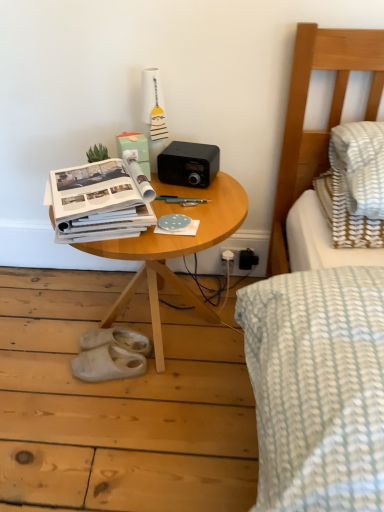
Question: Does white paper at center lie behind white rubber slippers at lower left, the 1th footwear in the front-to-back sequence?

Choices:
 (A) yes
 (B) no

Answer: (B)

Question: Is white paper at center bigger than white rubber slippers at lower left, the 1th footwear in the front-to-back sequence?

Choices:
 (A) yes
 (B) no

Answer: (A)

Question: Does white paper at center have a greater height compared to white rubber slippers at lower left, the second footwear when ordered from back to front?

Choices:
 (A) yes
 (B) no

Answer: (A)

Question: Is white paper at center aimed at white rubber slippers at lower left, the 1th footwear in the front-to-back sequence?

Choices:
 (A) no
 (B) yes

Answer: (A)

Question: Is white paper at center looking in the opposite direction of white rubber slippers at lower left, the second footwear when ordered from back to front?

Choices:
 (A) yes
 (B) no

Answer: (B)

Question: Would you say white paper at center contains white rubber slippers at lower left, the 1th footwear in the front-to-back sequence?

Choices:
 (A) no
 (B) yes

Answer: (A)

Question: Is wooden table at center closer to the viewer compared to white rubber slippers at lower left, the second footwear when ordered from back to front?

Choices:
 (A) yes
 (B) no

Answer: (A)

Question: Is wooden table at center outside white rubber slippers at lower left, the second footwear when ordered from back to front?

Choices:
 (A) no
 (B) yes

Answer: (B)

Question: Are wooden table at center and white rubber slippers at lower left, the second footwear when ordered from back to front, located far from each other?

Choices:
 (A) no
 (B) yes

Answer: (A)

Question: From a real-world perspective, is wooden table at center under white rubber slippers at lower left, the second footwear when ordered from back to front?

Choices:
 (A) no
 (B) yes

Answer: (A)

Question: Is the depth of wooden table at center greater than that of white rubber slippers at lower left, the second footwear when ordered from back to front?

Choices:
 (A) yes
 (B) no

Answer: (B)

Question: From a real-world perspective, does wooden table at center stand above white rubber slippers at lower left, the second footwear when ordered from back to front?

Choices:
 (A) yes
 (B) no

Answer: (A)

Question: From the image's perspective, is white rubber slippers at lower left, the second footwear when ordered from back to front, on wooden table at center?

Choices:
 (A) yes
 (B) no

Answer: (B)